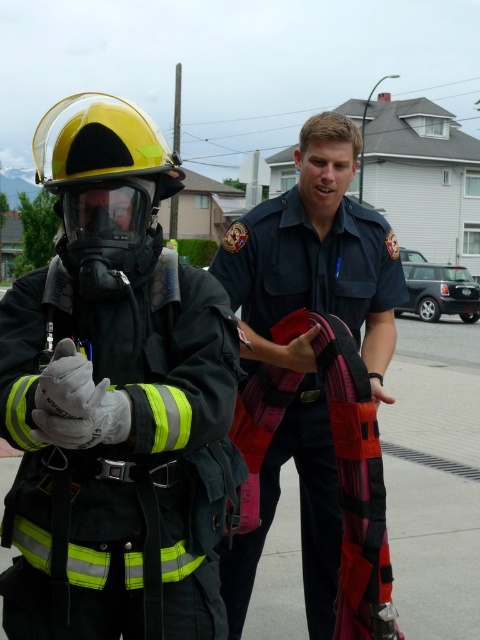
Is reflective black helmet at upper left bigger than dark blue uniform at center?

Indeed, reflective black helmet at upper left has a larger size compared to dark blue uniform at center.

The image size is (480, 640). What do you see at coordinates (115, 401) in the screenshot?
I see `reflective black helmet at upper left` at bounding box center [115, 401].

At what (x,y) coordinates should I click in order to perform the action: click on reflective black helmet at upper left. Please return your answer as a coordinate pair (x, y). This screenshot has height=640, width=480. Looking at the image, I should click on (115, 401).